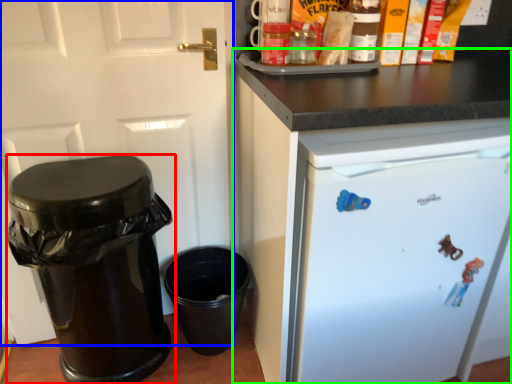
Question: Which is farther away from waste container (highlighted by a red box)? door (highlighted by a blue box) or cabinetry (highlighted by a green box)?

Choices:
 (A) door
 (B) cabinetry

Answer: (B)